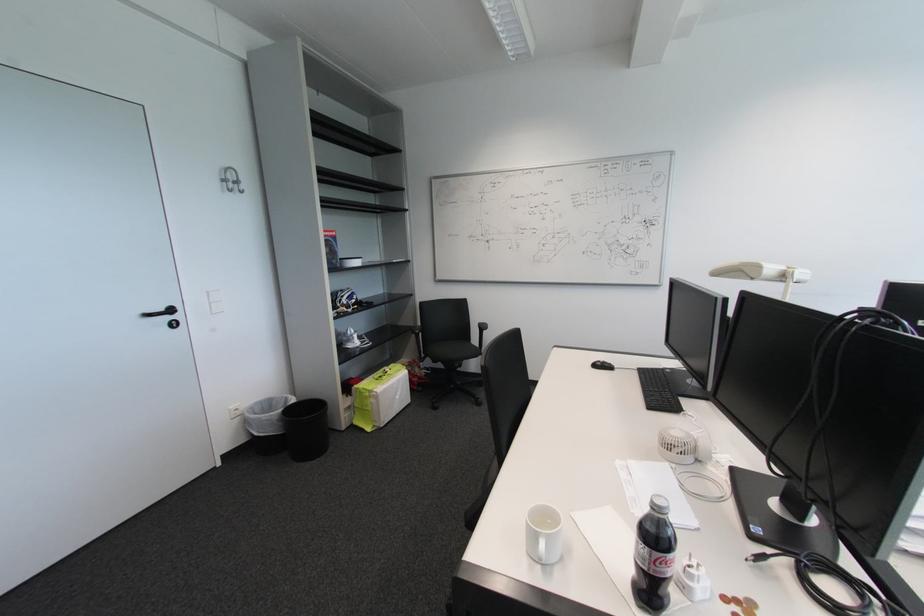
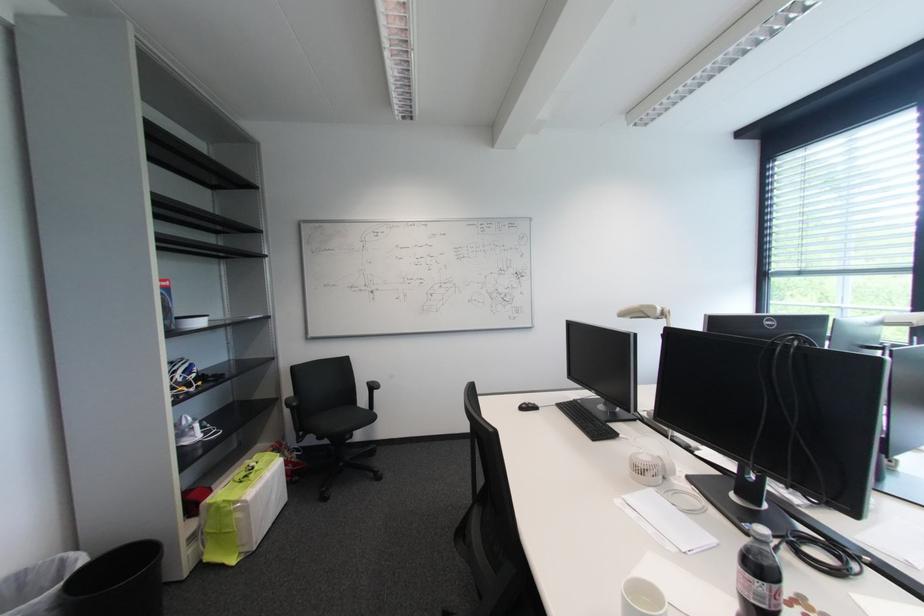
Locate, in the second image, the point that corresponds to [348,299] in the first image.

(181, 373)